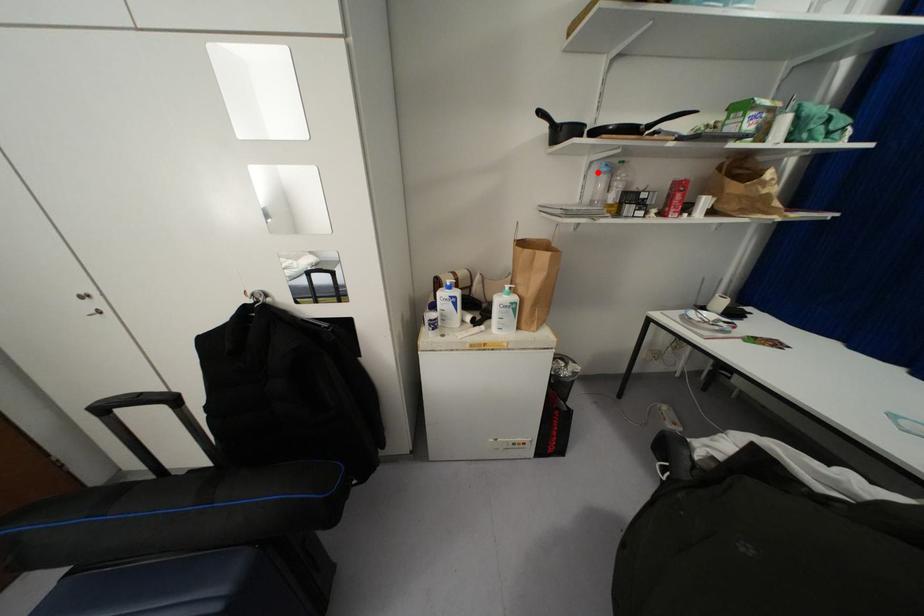
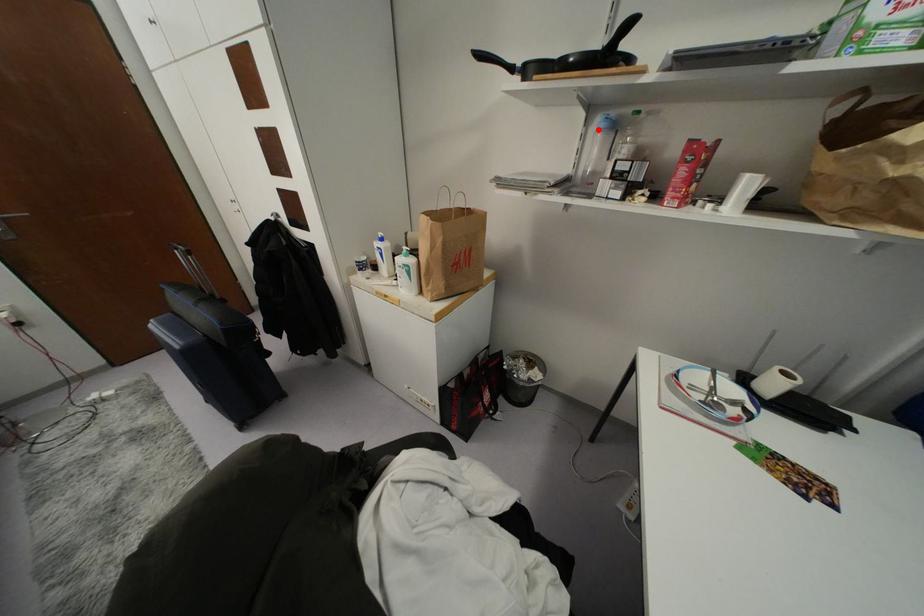
I am providing you with two images of the same scene from different viewpoints. A red point is marked on the first image and another point is marked on the second image. Do the highlighted points in image1 and image2 indicate the same real-world spot?

Yes